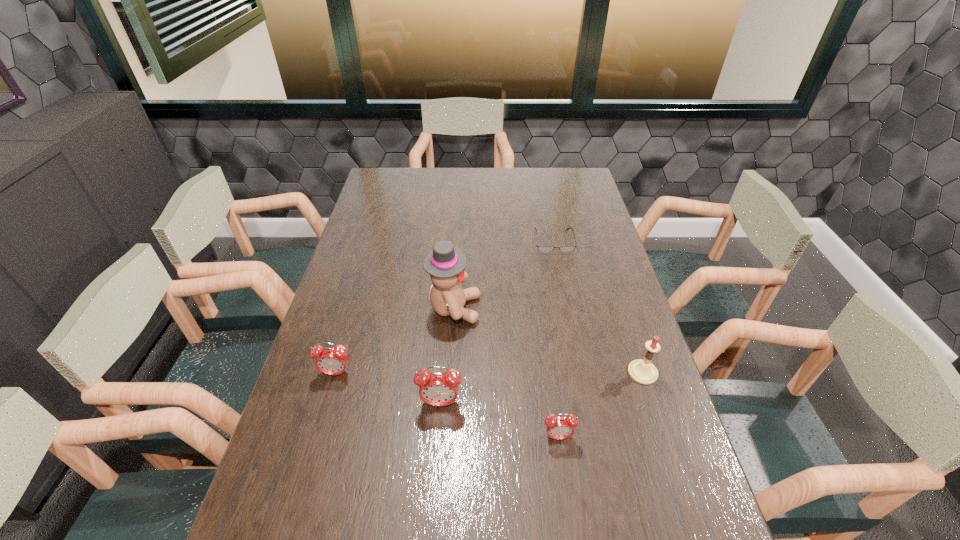
Locate an element on the screen. The height and width of the screenshot is (540, 960). the leftmost object is located at coordinates (332, 361).

I want to click on the third shortest object, so click(x=332, y=361).

Locate an element on the screen. The width and height of the screenshot is (960, 540). the second alarm clock from right to left is located at coordinates (437, 388).

Where is `the tallest alarm clock`? the tallest alarm clock is located at coordinates (437, 388).

Identify the location of the rightmost alarm clock. Image resolution: width=960 pixels, height=540 pixels. [560, 427].

In order to click on the shortest alarm clock in this screenshot , I will do `click(560, 427)`.

This screenshot has width=960, height=540. In order to click on candle in this screenshot , I will do `click(642, 371)`.

The width and height of the screenshot is (960, 540). Identify the location of rag_doll. (445, 263).

Identify the location of the tallest object. (445, 263).

The height and width of the screenshot is (540, 960). What are the coordinates of `the farthest object` in the screenshot? It's located at (541, 248).